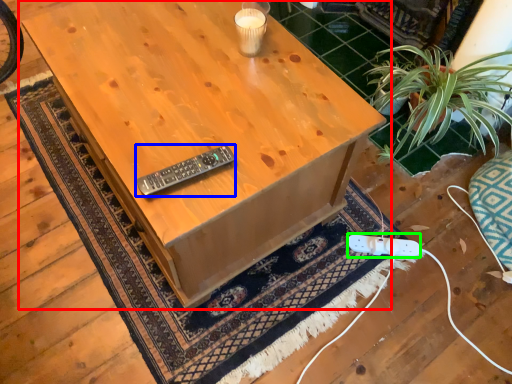
Question: Based on their relative distances, which object is nearer to table (highlighted by a red box)? Choose from control (highlighted by a blue box) and plug (highlighted by a green box).

Choices:
 (A) control
 (B) plug

Answer: (A)